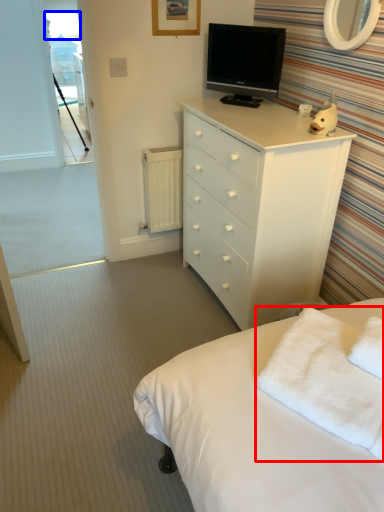
Question: Which object appears farthest to the camera in this image, towel/napkin (highlighted by a red box) or window screen (highlighted by a blue box)?

Choices:
 (A) towel/napkin
 (B) window screen

Answer: (B)